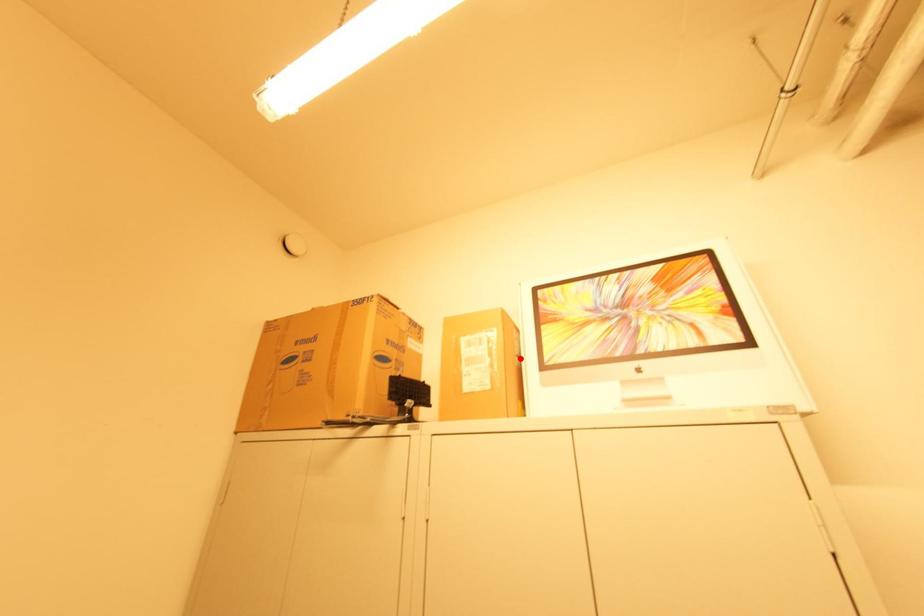
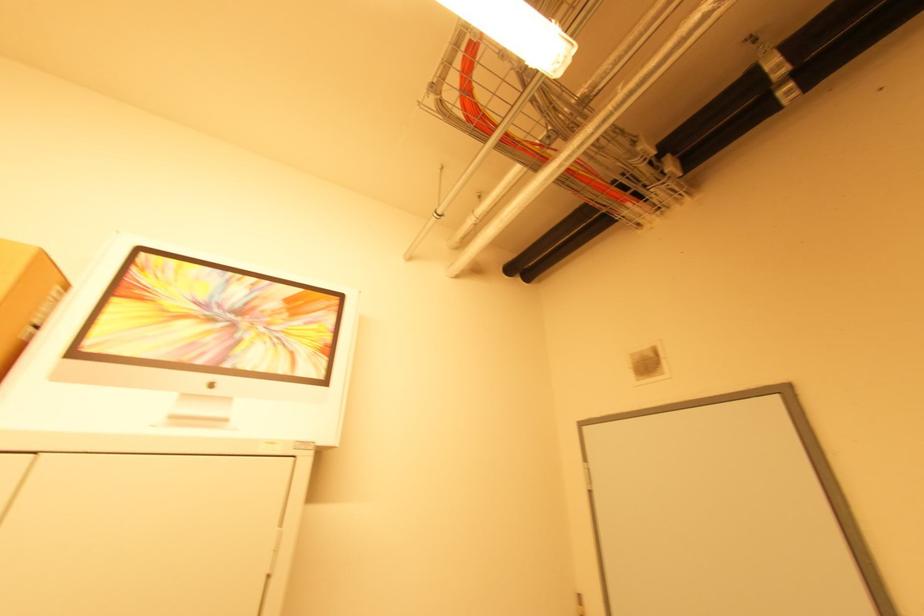
Where in the second image is the point corresponding to the highlighted location from the first image?

(32, 329)